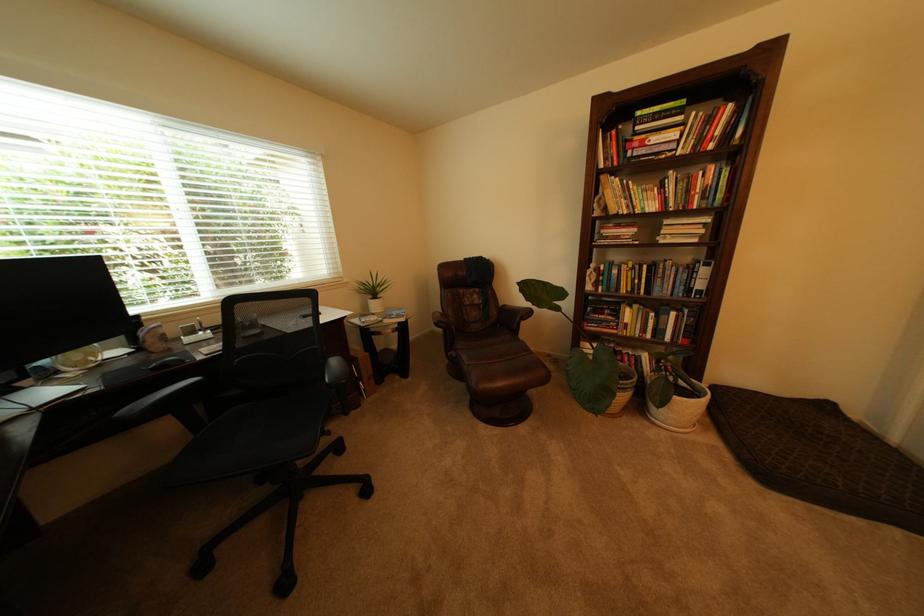
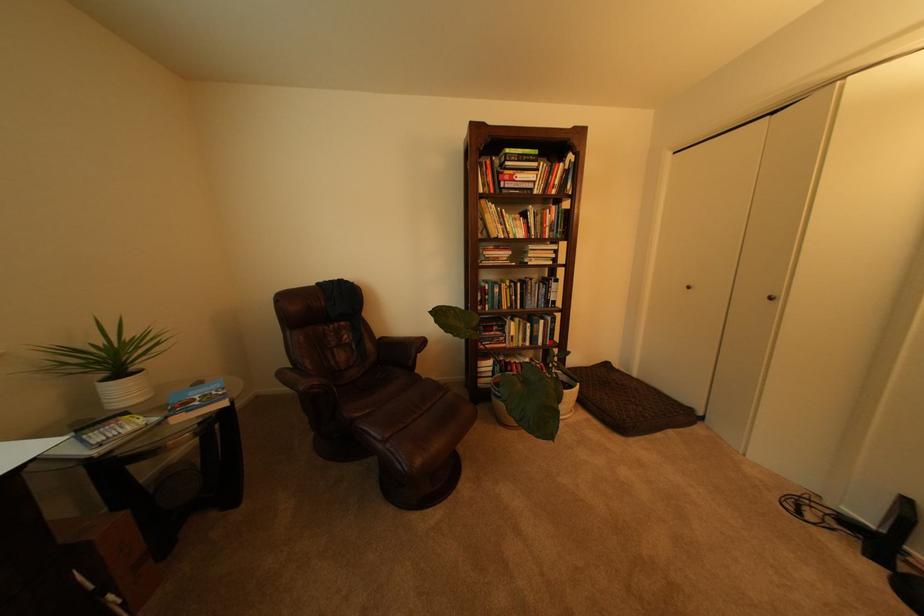
The point at (687, 399) is marked in the first image. Where is the corresponding point in the second image?

(576, 392)